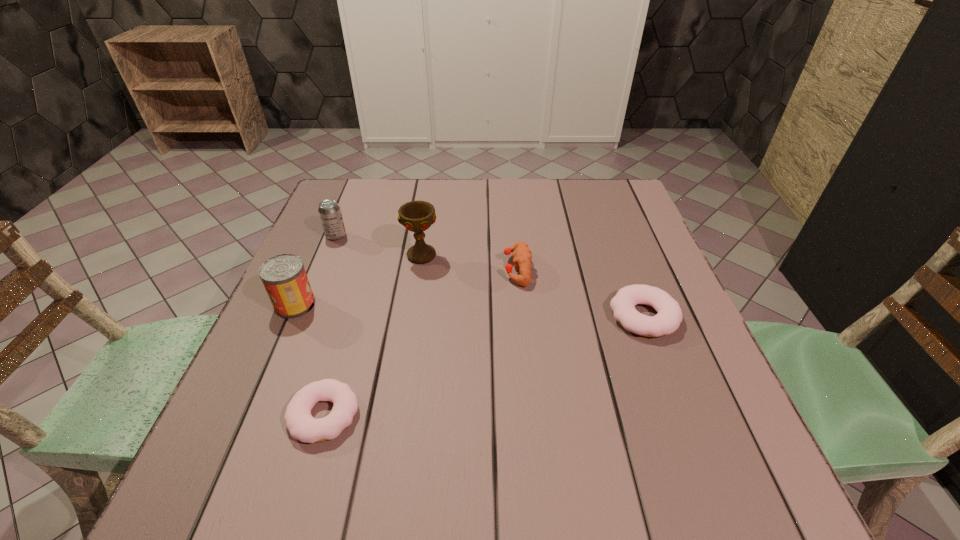
What are the coordinates of `beer can positioned at the left edge` in the screenshot? It's located at tap(329, 210).

Where is `can at the left edge`? can at the left edge is located at coordinates (284, 277).

Identify the location of object that is at the right edge. This screenshot has width=960, height=540. (667, 320).

The image size is (960, 540). Find the location of `object that is at the near left corner`. object that is at the near left corner is located at coordinates (301, 425).

In the image, there is a desktop. Identify the location of vacant area at the far edge. The image size is (960, 540). (533, 202).

Locate an element on the screen. The image size is (960, 540). free space at the left edge of the desktop is located at coordinates (272, 332).

The image size is (960, 540). In the image, there is a desktop. In order to click on free space at the right edge in this screenshot , I will do `click(633, 241)`.

This screenshot has height=540, width=960. Identify the location of vacant space at the far left corner of the desktop. (382, 180).

Where is `vacant area at the near left corner`? This screenshot has width=960, height=540. vacant area at the near left corner is located at coordinates (253, 422).

You are a GUI agent. You are given a task and a screenshot of the screen. Output one action in this format:
    pyautogui.click(x=<x>, y=<y>)
    Task: Click on the free spot between the second object from right to left and the left doughnut
    The image size is (960, 540).
    Given the screenshot: What is the action you would take?
    pyautogui.click(x=420, y=342)